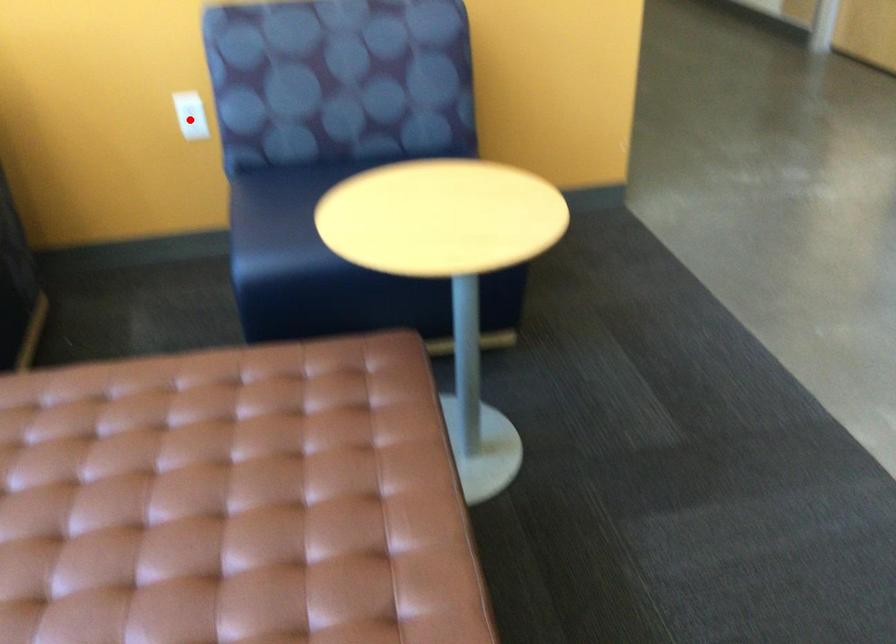
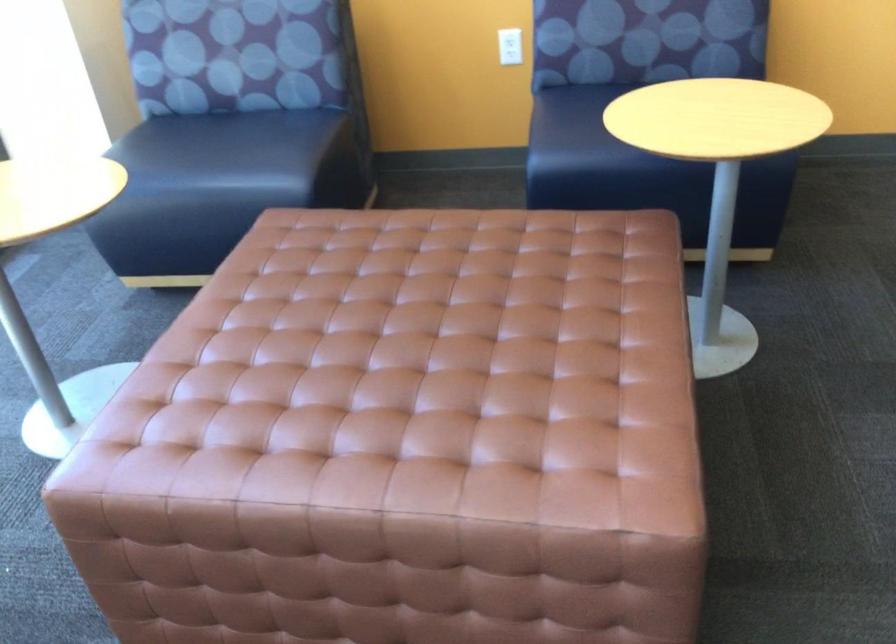
Question: A red point is marked in image1. In image2, is the corresponding 3D point closer to the camera or farther? Reply with the corresponding letter.

Choices:
 (A) The corresponding 3D point is closer.
 (B) The corresponding 3D point is farther.

Answer: (B)